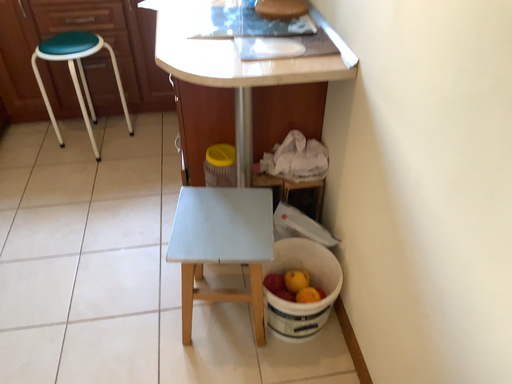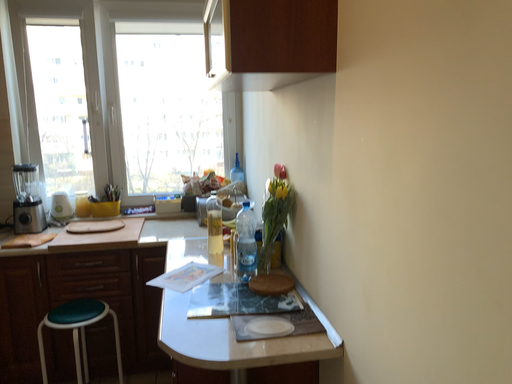
Question: How did the camera likely rotate when shooting the video?

Choices:
 (A) rotated upward
 (B) rotated downward

Answer: (A)